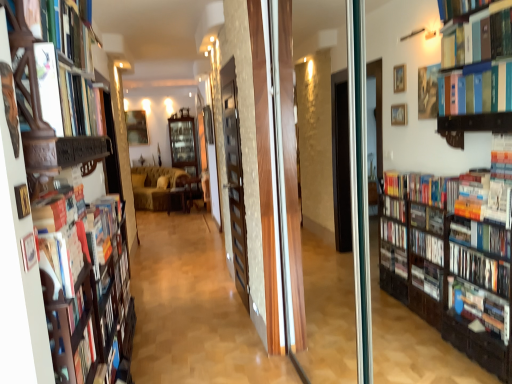
Question: From the image's perspective, does wooden chair at center, which is counted as the 1th furniture, starting from the right, appear higher than wooden cabinet at center, the first shelf from the left?

Choices:
 (A) no
 (B) yes

Answer: (A)

Question: Is wooden chair at center, which is counted as the 1th furniture, starting from the right, facing towards wooden cabinet at center, which is the 2th shelf from front to back?

Choices:
 (A) no
 (B) yes

Answer: (A)

Question: Is wooden chair at center, which appears as the 2th furniture when viewed from the left, positioned with its back to wooden cabinet at center, the first shelf from the left?

Choices:
 (A) yes
 (B) no

Answer: (A)

Question: Is wooden chair at center, which is counted as the 1th furniture, starting from the right, with wooden cabinet at center, which is the 2th shelf from front to back?

Choices:
 (A) yes
 (B) no

Answer: (B)

Question: Considering the relative positions of wooden chair at center, which is counted as the 1th furniture, starting from the right, and wooden cabinet at center, which is the 2th shelf from front to back, in the image provided, is wooden chair at center, which is counted as the 1th furniture, starting from the right, to the right of wooden cabinet at center, which is the 2th shelf from front to back, from the viewer's perspective?

Choices:
 (A) yes
 (B) no

Answer: (A)

Question: Is wooden bookshelf at left, the 2th shelf in the left-to-right sequence, taller or shorter than wooden cabinet at center, the first shelf from the left?

Choices:
 (A) short
 (B) tall

Answer: (A)

Question: From the image's perspective, is wooden bookshelf at left, the first shelf when ordered from front to back, positioned above or below wooden cabinet at center, acting as the 1th shelf starting from the back?

Choices:
 (A) below
 (B) above

Answer: (A)

Question: Is wooden bookshelf at left, which is the 1th shelf in right-to-left order, situated inside wooden cabinet at center, which is the 2th shelf from front to back, or outside?

Choices:
 (A) outside
 (B) inside

Answer: (A)

Question: Is point (102, 155) positioned closer to the camera than point (172, 119)?

Choices:
 (A) farther
 (B) closer

Answer: (B)

Question: Considering the positions of point (182, 200) and point (157, 210), is point (182, 200) closer or farther from the camera than point (157, 210)?

Choices:
 (A) closer
 (B) farther

Answer: (A)

Question: Relative to velvet yellow couch at center, is wooden cabinet at center, which is counted as the 2th furniture, starting from the right, in front or behind?

Choices:
 (A) behind
 (B) front

Answer: (B)

Question: Looking at their shapes, would you say wooden cabinet at center, which is counted as the 2th furniture, starting from the right, is wider or thinner than velvet yellow couch at center?

Choices:
 (A) thin
 (B) wide

Answer: (A)

Question: Do you think wooden cabinet at center, which is counted as the 2th furniture, starting from the right, is within velvet yellow couch at center, or outside of it?

Choices:
 (A) outside
 (B) inside

Answer: (A)

Question: In terms of width, does wooden chair at center, which appears as the 2th furniture when viewed from the left, look wider or thinner when compared to hardcover book at upper left, which ranks as the 1th book in top-to-bottom order?

Choices:
 (A) wide
 (B) thin

Answer: (A)

Question: In terms of height, does wooden chair at center, which appears as the 2th furniture when viewed from the left, look taller or shorter compared to hardcover book at upper left, which ranks as the 1th book in top-to-bottom order?

Choices:
 (A) short
 (B) tall

Answer: (B)